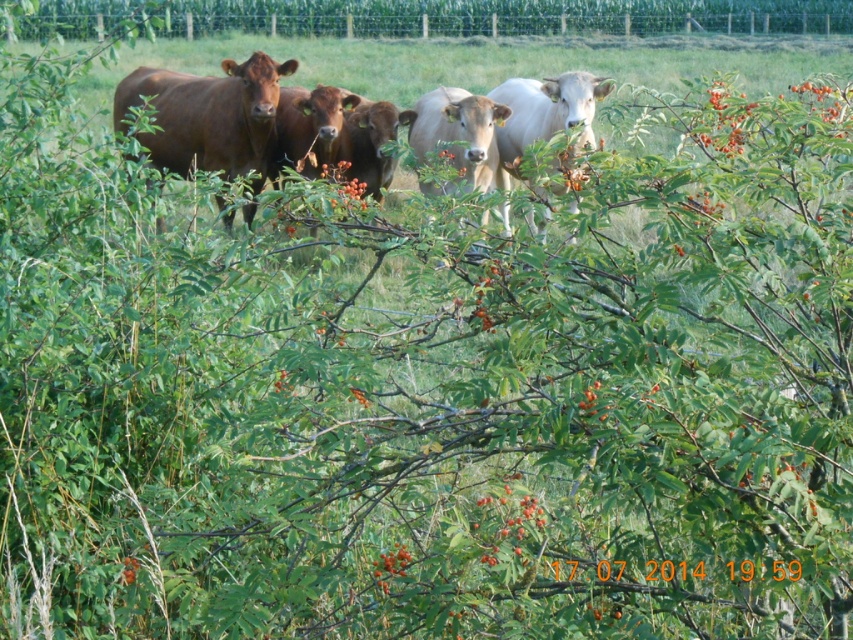
Which is below, matte brown cow at center or white glossy bull at center?

matte brown cow at center

Describe the element at coordinates (207, 115) in the screenshot. This screenshot has height=640, width=853. I see `matte brown cow at center` at that location.

This screenshot has height=640, width=853. I want to click on matte brown cow at center, so click(207, 115).

This screenshot has width=853, height=640. In order to click on matte brown cow at center in this screenshot , I will do `click(207, 115)`.

Does brown glossy cows at center appear under white glossy bull at center?

Indeed, brown glossy cows at center is positioned under white glossy bull at center.

Between point (483, 104) and point (589, 120), which one is positioned behind?

The point (483, 104) is behind.

Identify the location of brown glossy cows at center. This screenshot has height=640, width=853. (244, 122).

Is brown glossy cows at center smaller than matte brown cow at center?

No.

The width and height of the screenshot is (853, 640). Describe the element at coordinates (244, 122) in the screenshot. I see `brown glossy cows at center` at that location.

Locate an element on the screen. Image resolution: width=853 pixels, height=640 pixels. brown glossy cows at center is located at coordinates (244, 122).